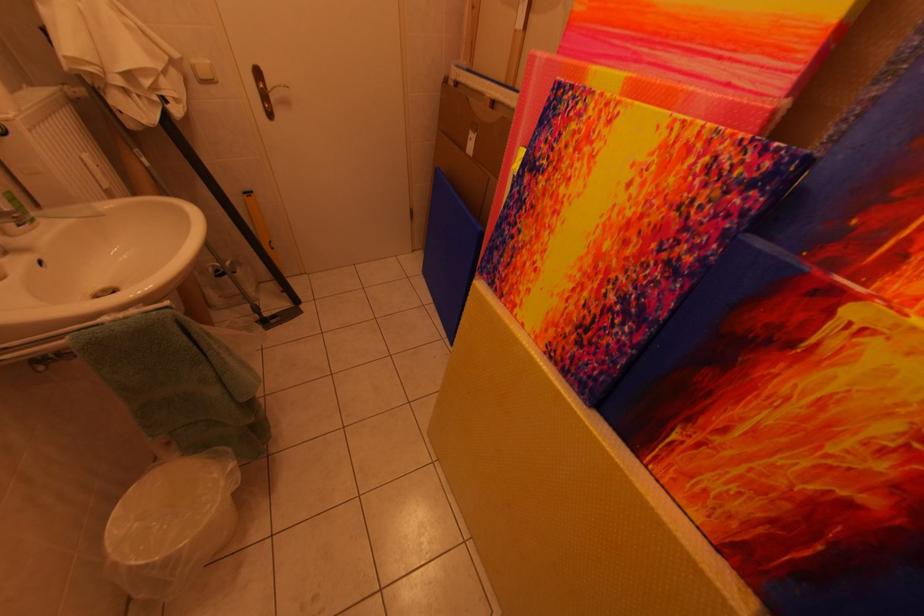
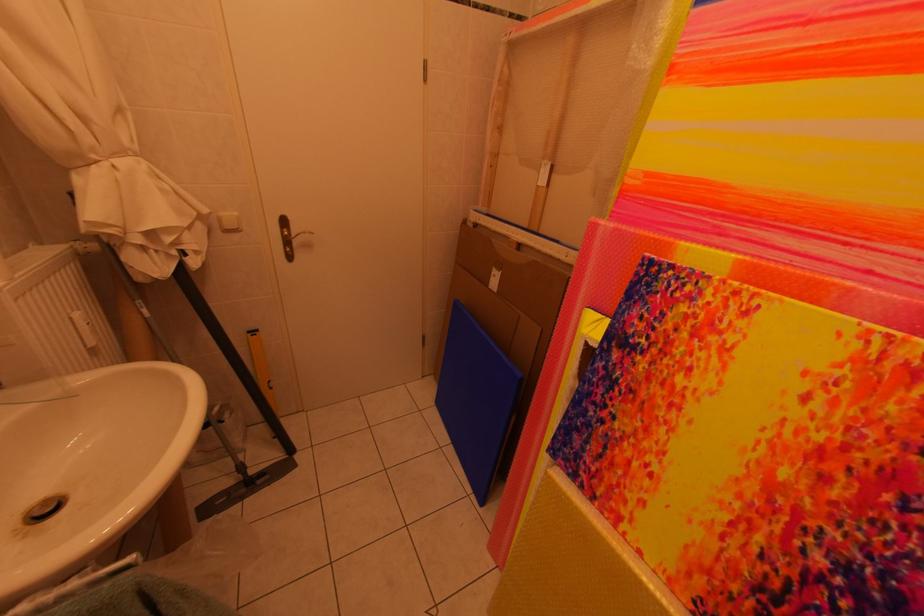
The point at (x=91, y=161) is marked in the first image. Where is the corresponding point in the second image?

(79, 321)